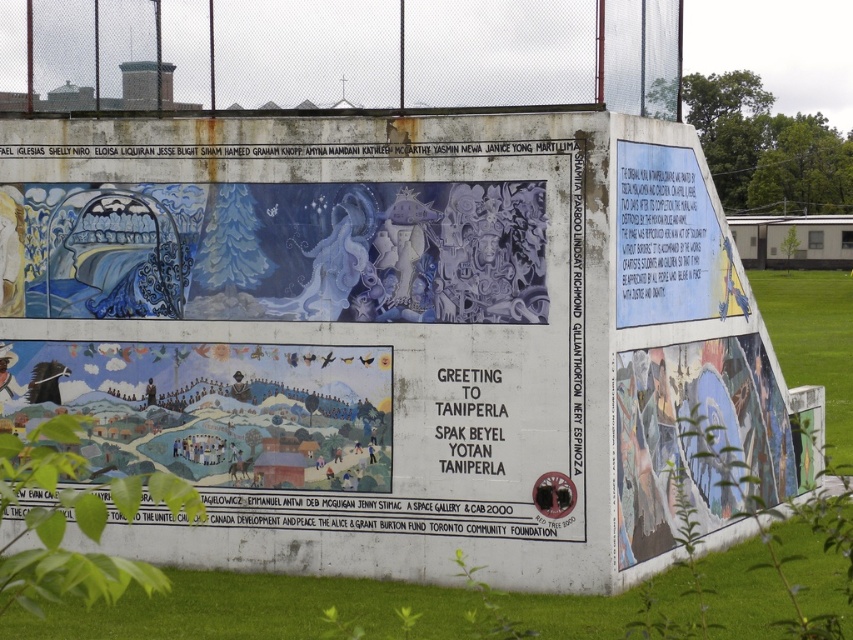
Describe the element at coordinates (314, 324) in the screenshot. I see `matte blue mural at center` at that location.

Can you confirm if matte blue mural at center is smaller than white paper plaque at upper right?

Actually, matte blue mural at center might be larger than white paper plaque at upper right.

Is point (273, 323) closer to viewer compared to point (712, 257)?

Yes, it is.

This screenshot has height=640, width=853. I want to click on matte blue mural at center, so click(314, 324).

Does matte blue mural at right have a lesser width compared to white paper plaque at upper right?

No, matte blue mural at right is not thinner than white paper plaque at upper right.

Is point (633, 534) less distant than point (660, 275)?

Yes, it is.

Find the location of a particular element. The image size is (853, 640). matte blue mural at right is located at coordinates (695, 440).

Can you confirm if pastel painted mural at center is positioned to the left of matte blue mural at right?

Indeed, pastel painted mural at center is positioned on the left side of matte blue mural at right.

Which is behind, point (9, 378) or point (752, 458)?

The point (752, 458) is behind.

This screenshot has width=853, height=640. What do you see at coordinates (213, 410) in the screenshot?
I see `pastel painted mural at center` at bounding box center [213, 410].

Image resolution: width=853 pixels, height=640 pixels. I want to click on pastel painted mural at center, so click(x=213, y=410).